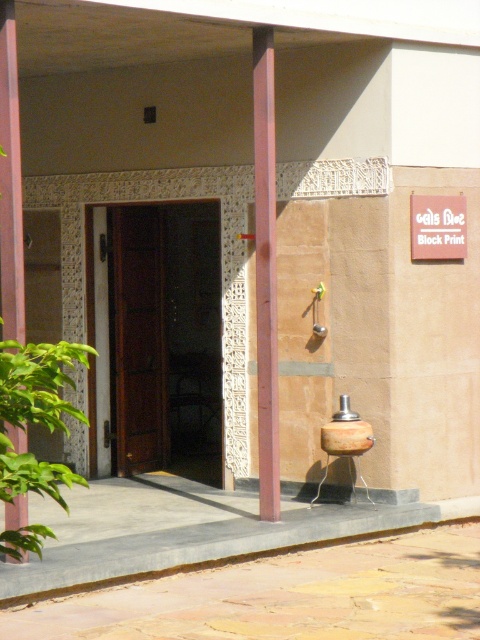
Question: Can you confirm if brown wooden door at center is positioned to the right of white wood sign at upper right?

Choices:
 (A) no
 (B) yes

Answer: (A)

Question: Which point appears closest to the camera in this image?

Choices:
 (A) (140, 444)
 (B) (276, 504)
 (C) (433, 220)

Answer: (B)

Question: In this image, where is smooth pink pillar at left located relative to white wood sign at upper right?

Choices:
 (A) left
 (B) right

Answer: (A)

Question: Considering the real-world distances, which object is farthest from the smooth reddish-brown post at center?

Choices:
 (A) brown wooden door at center
 (B) white wood sign at upper right
 (C) smooth pink pillar at left

Answer: (A)

Question: Which is nearer to the brown wooden door at center?

Choices:
 (A) smooth reddish-brown post at center
 (B) white wood sign at upper right
 (C) smooth pink pillar at left

Answer: (B)

Question: Can you confirm if smooth pink pillar at left is bigger than white wood sign at upper right?

Choices:
 (A) no
 (B) yes

Answer: (B)